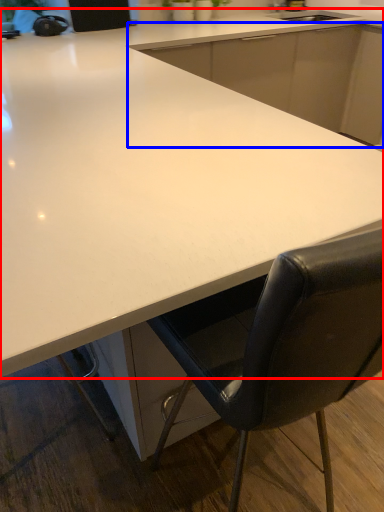
Question: Which object is further to the camera taking this photo, countertop (highlighted by a red box) or cabinetry (highlighted by a blue box)?

Choices:
 (A) countertop
 (B) cabinetry

Answer: (B)